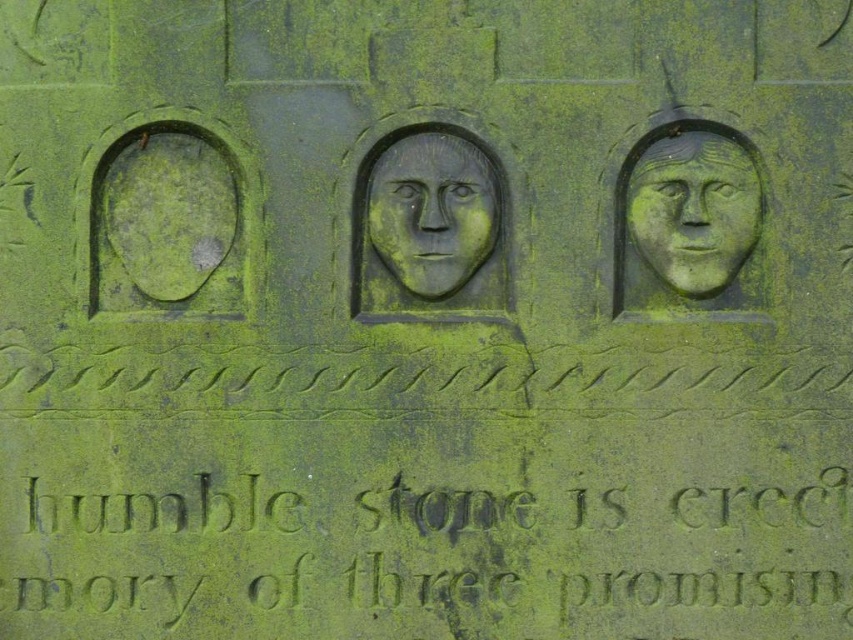
Can you confirm if green stone engraving at center is bigger than green stone carving at center?

Yes.

Between green stone engraving at center and green stone carving at center, which one is positioned lower?

green stone engraving at center

What do you see at coordinates (577, 552) in the screenshot?
I see `green stone engraving at center` at bounding box center [577, 552].

The width and height of the screenshot is (853, 640). Identify the location of green stone engraving at center. (577, 552).

Can you confirm if green stone engraving at center is positioned to the left of gray stone face at center?

Correct, you'll find green stone engraving at center to the left of gray stone face at center.

Does green stone engraving at center have a greater width compared to gray stone face at center?

Yes, green stone engraving at center is wider than gray stone face at center.

Does point (741, 548) lie behind point (447, 243)?

No.

Where is `green stone engraving at center`? green stone engraving at center is located at coordinates (577, 552).

Can you confirm if green stone carving at center is taller than gray stone face at center?

Correct, green stone carving at center is much taller as gray stone face at center.

Find the location of a particular element. This screenshot has width=853, height=640. green stone carving at center is located at coordinates (693, 211).